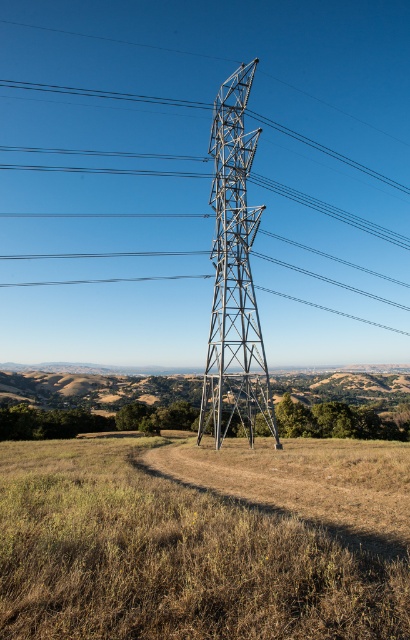
Which is behind, point (216, 628) or point (230, 387)?

The point (230, 387) is more distant.

Which of these two, brown dry grass at center or metallic gray tower at center, stands taller?

metallic gray tower at center

Is point (11, 532) farther from camera compared to point (254, 349)?

No.

Locate an element on the screen. The image size is (410, 640). brown dry grass at center is located at coordinates (173, 557).